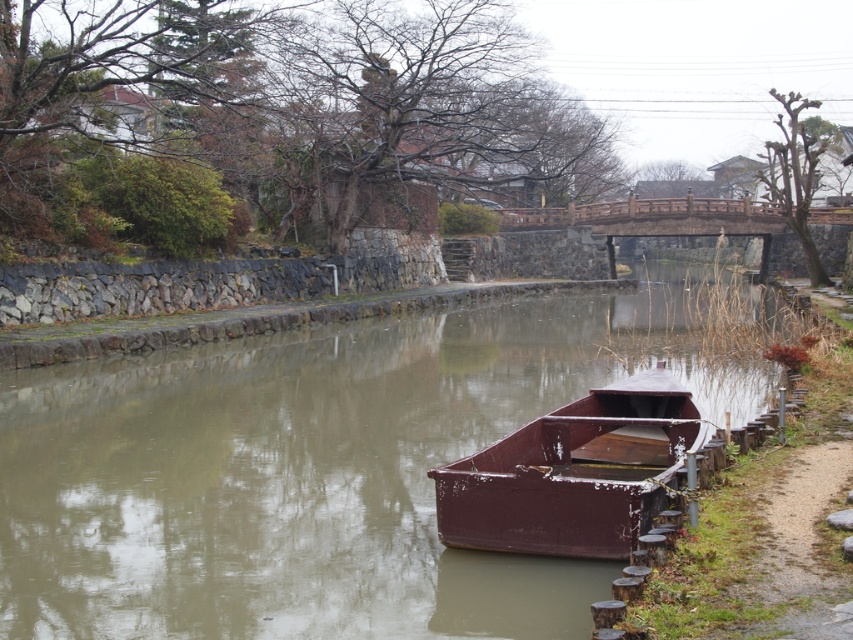
Is point (227, 381) positioned behind point (618, 442)?

Yes, it is.

Locate an element on the screen. This screenshot has height=640, width=853. smooth brown water at center is located at coordinates (318, 470).

This screenshot has height=640, width=853. Find the location of `smooth brown water at center`. smooth brown water at center is located at coordinates (318, 470).